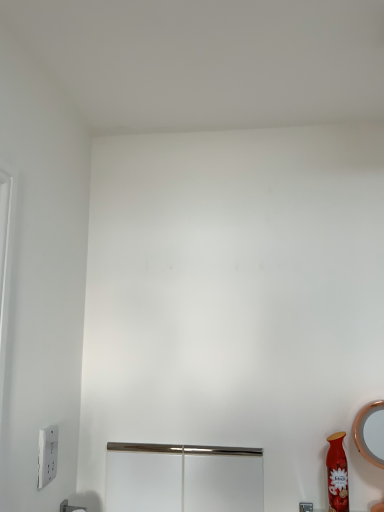
Question: From the image's perspective, is polished metal screen door at center on top of white plastic light switch at lower left?

Choices:
 (A) no
 (B) yes

Answer: (A)

Question: Would you say polished metal screen door at center contains white plastic light switch at lower left?

Choices:
 (A) yes
 (B) no

Answer: (B)

Question: Would you say polished metal screen door at center is a long distance from white plastic light switch at lower left?

Choices:
 (A) no
 (B) yes

Answer: (A)

Question: Considering the relative sizes of polished metal screen door at center and white plastic light switch at lower left in the image provided, is polished metal screen door at center smaller than white plastic light switch at lower left?

Choices:
 (A) yes
 (B) no

Answer: (B)

Question: Considering the relative sizes of polished metal screen door at center and white plastic light switch at lower left in the image provided, is polished metal screen door at center wider than white plastic light switch at lower left?

Choices:
 (A) no
 (B) yes

Answer: (B)

Question: From the image's perspective, does polished metal screen door at center appear lower than white plastic light switch at lower left?

Choices:
 (A) yes
 (B) no

Answer: (A)

Question: Is polished metal screen door at center positioned far away from matte red vase at lower right?

Choices:
 (A) no
 (B) yes

Answer: (A)

Question: Does polished metal screen door at center have a larger size compared to matte red vase at lower right?

Choices:
 (A) yes
 (B) no

Answer: (A)

Question: Can you confirm if polished metal screen door at center is thinner than matte red vase at lower right?

Choices:
 (A) yes
 (B) no

Answer: (A)

Question: Does polished metal screen door at center appear on the right side of matte red vase at lower right?

Choices:
 (A) yes
 (B) no

Answer: (B)

Question: Does polished metal screen door at center have a greater width compared to matte red vase at lower right?

Choices:
 (A) yes
 (B) no

Answer: (B)

Question: Can you confirm if polished metal screen door at center is smaller than matte red vase at lower right?

Choices:
 (A) no
 (B) yes

Answer: (A)

Question: Can you confirm if matte red vase at lower right is shorter than polished metal screen door at center?

Choices:
 (A) yes
 (B) no

Answer: (B)